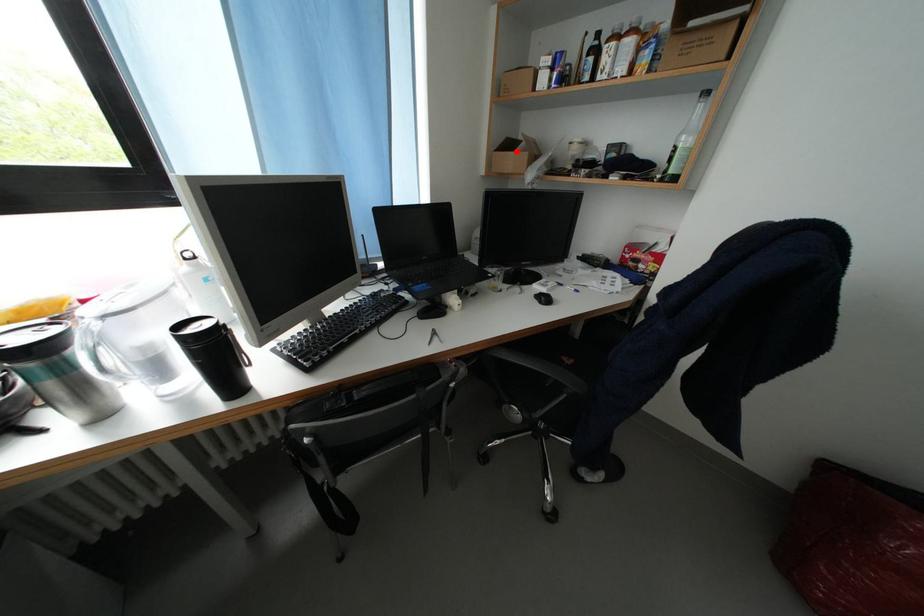
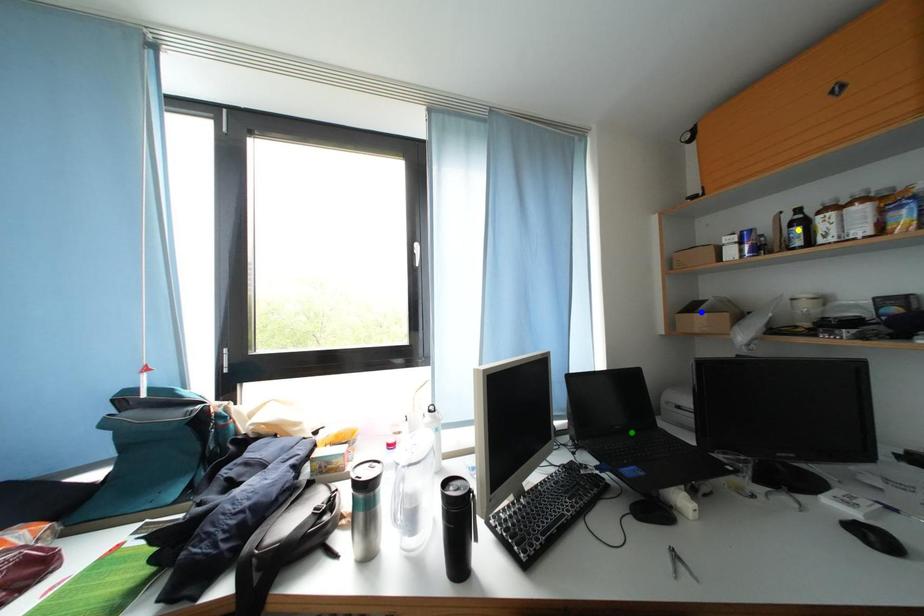
Question: I am providing you with two images of the same scene from different viewpoints. A red point is marked on the first image. You are given multiple points on the second image. Which point in image 2 is actually the same real-world point as the red point in image 1?

Choices:
 (A) blue point
 (B) yellow point
 (C) green point

Answer: (A)